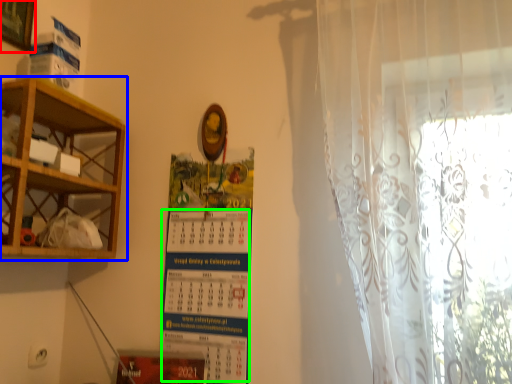
Question: Which is nearer to the picture frame (highlighted by a red box)? shelf (highlighted by a blue box) or writing (highlighted by a green box).

Choices:
 (A) shelf
 (B) writing

Answer: (A)